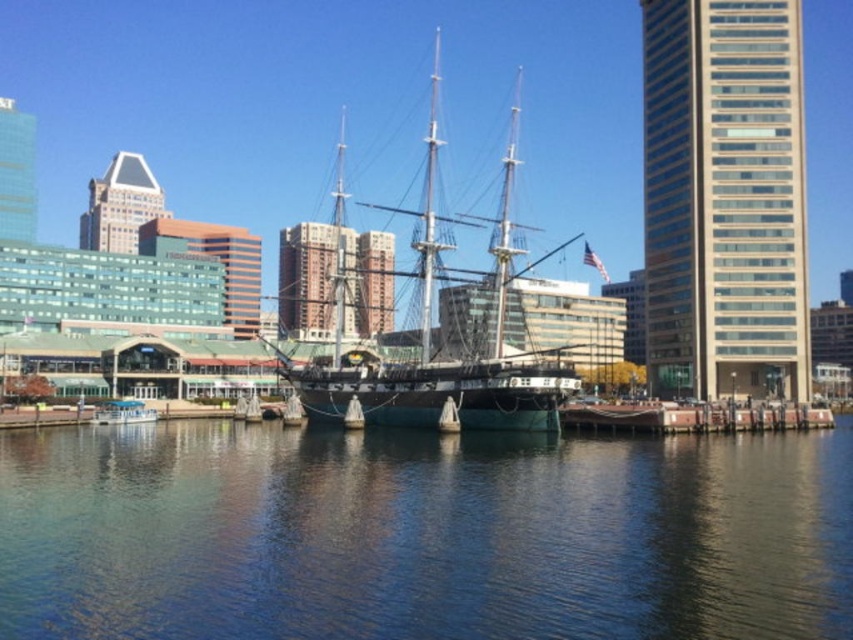
Is blue water at center positioned behind teal wooden ship at center?

That is False.

Does blue water at center have a larger size compared to teal wooden ship at center?

No.

Measure the distance between blue water at center and camera.

blue water at center and camera are 27.70 meters apart.

Find the location of `blue water at center`. blue water at center is located at coordinates (422, 536).

Who is more distant from viewer, [165,436] or [112,404]?

Point [112,404]

Does blue water at center appear under green wooden boat at lower center?

Yes.

Between point (653, 525) and point (115, 419), which one is positioned behind?

Positioned behind is point (115, 419).

Where is `blue water at center`? The width and height of the screenshot is (853, 640). blue water at center is located at coordinates (422, 536).

Does teal wooden ship at center have a smaller size compared to green wooden boat at lower center?

Incorrect, teal wooden ship at center is not smaller in size than green wooden boat at lower center.

Does teal wooden ship at center have a greater width compared to green wooden boat at lower center?

Yes, teal wooden ship at center is wider than green wooden boat at lower center.

Describe the element at coordinates (428, 349) in the screenshot. The image size is (853, 640). I see `teal wooden ship at center` at that location.

Where is `teal wooden ship at center`? This screenshot has height=640, width=853. teal wooden ship at center is located at coordinates (428, 349).